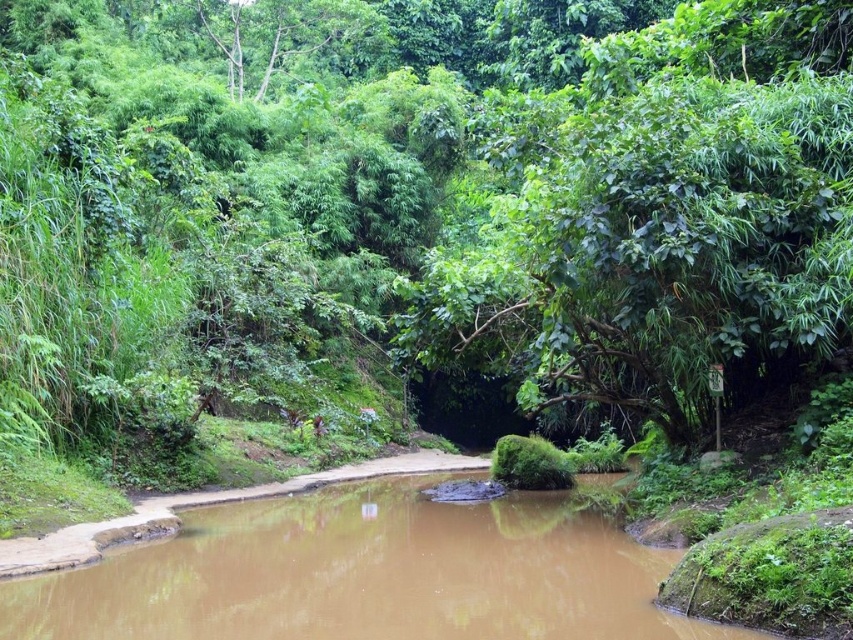
You are standing at the point with coordinates (659,216) in the image. What object is located exactly at this point?

The green leafy tree at center is located exactly at point (659,216).